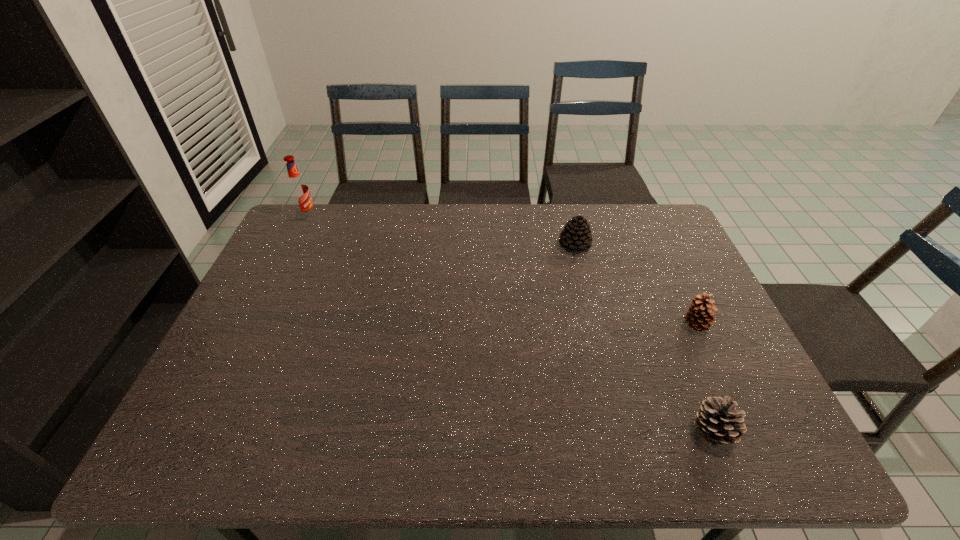
This screenshot has width=960, height=540. What are the coordinates of `root beer at the far edge` in the screenshot? It's located at (298, 189).

This screenshot has width=960, height=540. Identify the location of pinecone at the far edge. (576, 236).

Find the location of a particular element. object located in the near edge section of the desktop is located at coordinates (717, 421).

This screenshot has width=960, height=540. In order to click on object present at the left edge in this screenshot , I will do `click(298, 189)`.

What are the coordinates of `object positioned at the far left corner` in the screenshot? It's located at (298, 189).

This screenshot has height=540, width=960. Identify the location of object that is at the near right corner. (717, 421).

Locate an element on the screen. vacant area at the far edge of the desktop is located at coordinates click(x=583, y=214).

Where is `free space at the near edge of the desktop`? free space at the near edge of the desktop is located at coordinates (674, 464).

Locate an element on the screen. This screenshot has height=540, width=960. free region at the left edge of the desktop is located at coordinates (304, 298).

Locate an element on the screen. The height and width of the screenshot is (540, 960). free location at the right edge is located at coordinates (674, 323).